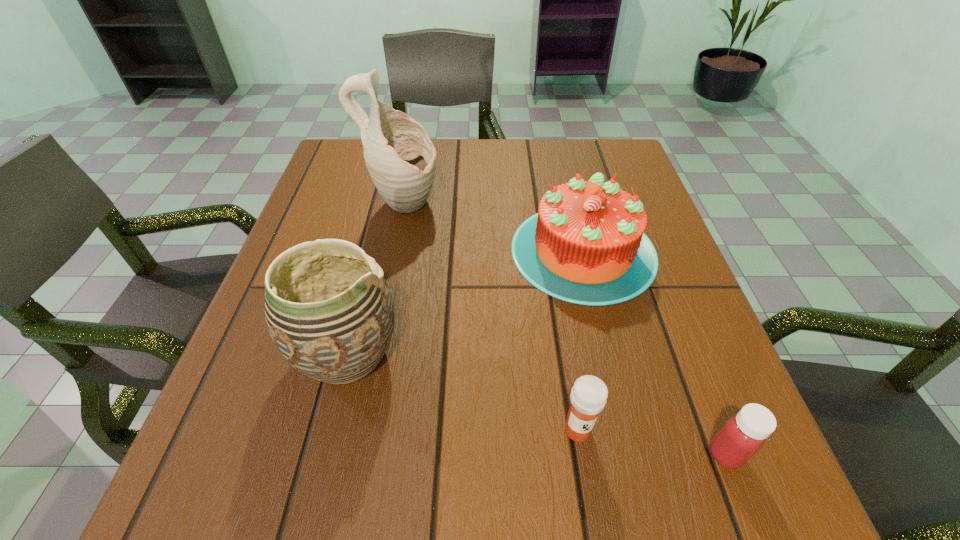
Where is `the tallest object`? The width and height of the screenshot is (960, 540). the tallest object is located at coordinates (401, 159).

Find the location of a particular element. The width and height of the screenshot is (960, 540). the fourth shortest object is located at coordinates (330, 314).

Where is `the third farthest object`? the third farthest object is located at coordinates coord(330,314).

Find the location of `the third tallest object`. the third tallest object is located at coordinates (586, 245).

I want to click on the left medicine, so click(x=589, y=394).

Image resolution: width=960 pixels, height=540 pixels. In order to click on the right medicine in this screenshot , I will do `click(743, 435)`.

Where is `free region located 0.350m at the spout of the pitcher`? free region located 0.350m at the spout of the pitcher is located at coordinates (593, 206).

At what (x,y) coordinates should I click in order to perform the action: click on free location located on the right of the third nearest object. Please return your answer as a coordinate pair (x, y). This screenshot has height=540, width=960. Looking at the image, I should click on (607, 354).

Locate an element on the screen. The image size is (960, 540). blank space located 0.270m on the left of the cake is located at coordinates (379, 251).

Find the location of a particular element. free space located 0.090m on the label side of the left medicine is located at coordinates (591, 515).